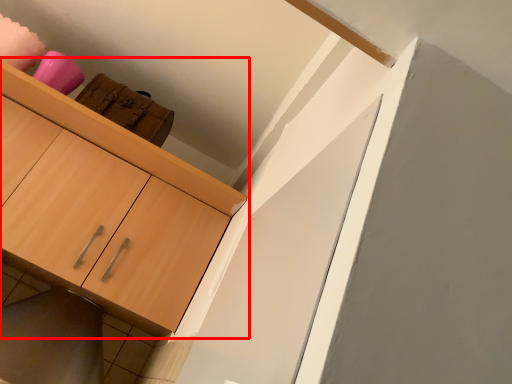
Question: Where is cabinetry (annotated by the red box) located in relation to tile in the image?

Choices:
 (A) left
 (B) right

Answer: (A)